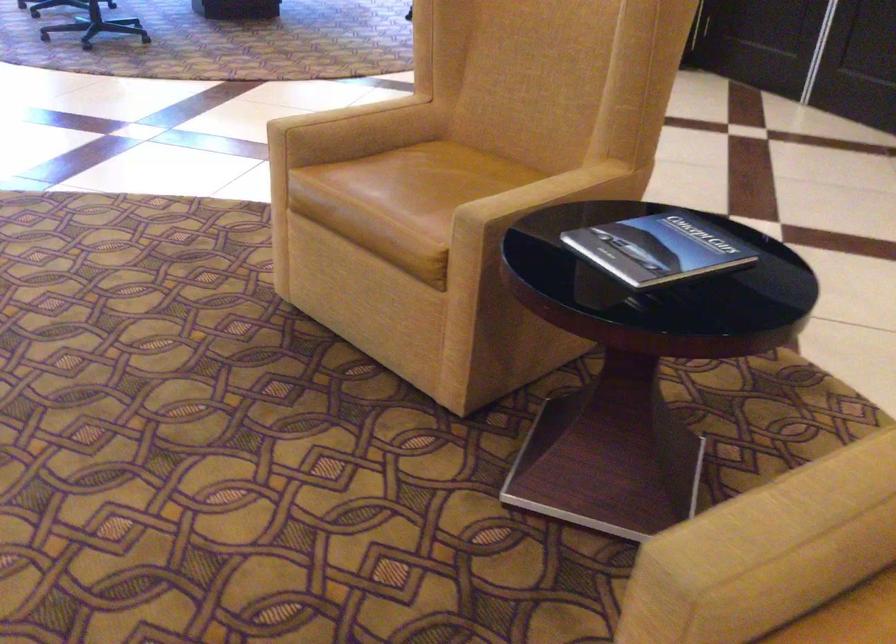
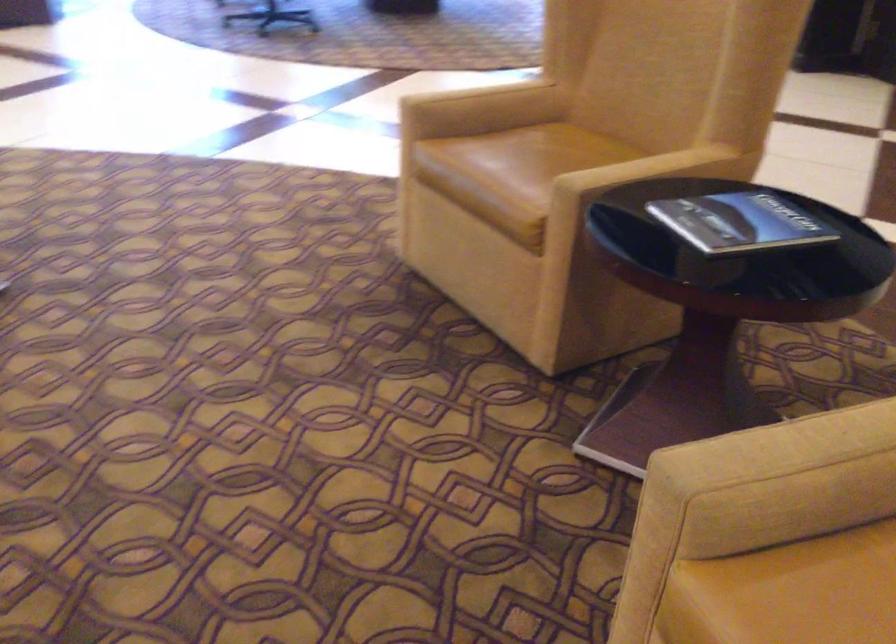
From the picture: The images are taken continuously from a first-person perspective. In which direction are you moving?

The movement direction of the cameraman is right, backward.